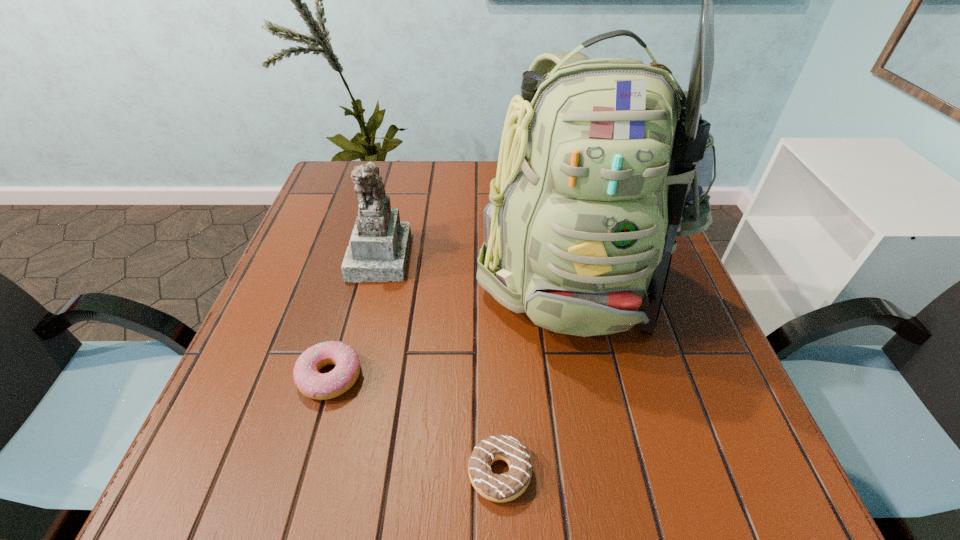
This screenshot has width=960, height=540. What are the coordinates of `object that is the third closest to the second tallest object` in the screenshot? It's located at (508, 486).

Locate which object ranks third in proximity to the farther doughnut. Please provide its 2D coordinates. Your answer should be formatted as a tuple, i.e. [(x, y)], where the tuple contains the x and y coordinates of a point satisfying the conditions above.

[(508, 486)]

This screenshot has width=960, height=540. Find the location of `free space that satisfies the following two spatial constraints: 1. on the front side of the right doughnut; 2. on the left side of the second shortest object`. free space that satisfies the following two spatial constraints: 1. on the front side of the right doughnut; 2. on the left side of the second shortest object is located at coordinates (302, 473).

This screenshot has width=960, height=540. I want to click on vacant point that satisfies the following two spatial constraints: 1. on the back side of the nearer doughnut; 2. on the front-facing side of the third shortest object, so click(492, 255).